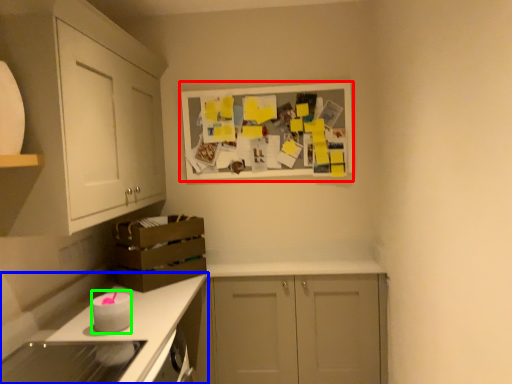
Question: Which is farther away from picture frame (highlighted by a red box)? countertop (highlighted by a blue box) or appliance (highlighted by a green box)?

Choices:
 (A) countertop
 (B) appliance

Answer: (B)